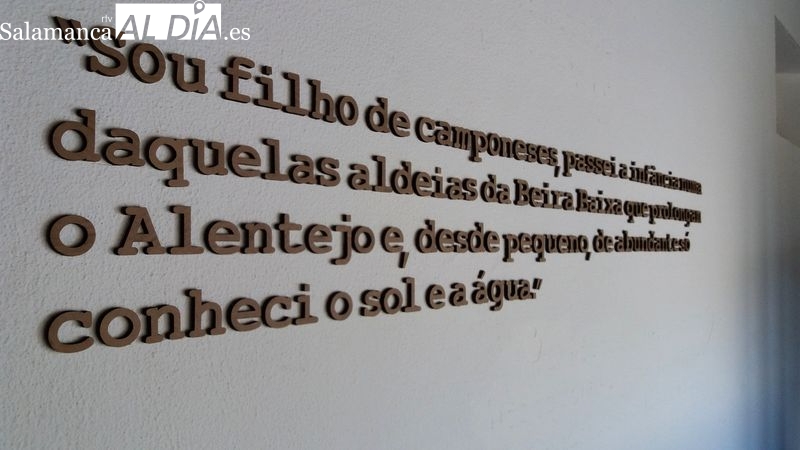
Where is `corners`? Image resolution: width=800 pixels, height=450 pixels. corners is located at coordinates [x=774, y=15], [x=774, y=133].